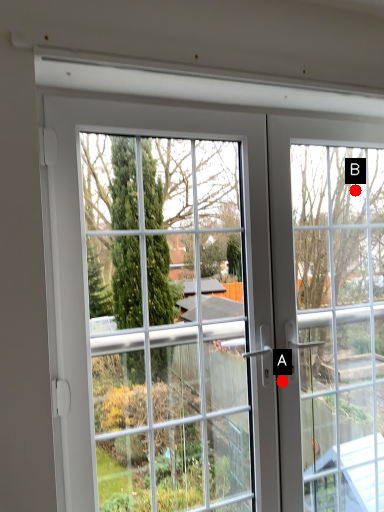
Question: Two points are circled on the image, labeled by A and B beside each circle. Among these points, which one is farthest from the camera?

Choices:
 (A) A is further
 (B) B is further

Answer: (B)